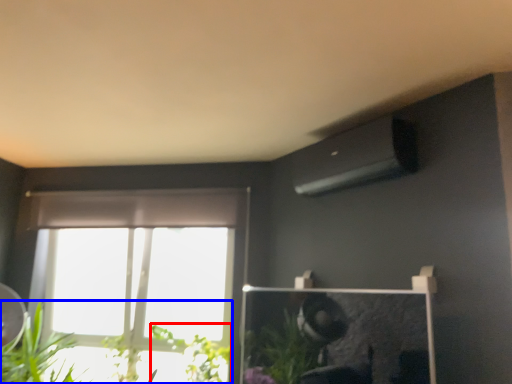
Question: Which object appears farthest to the camera in this image, plant (highlighted by a red box) or houseplant (highlighted by a blue box)?

Choices:
 (A) plant
 (B) houseplant

Answer: (A)